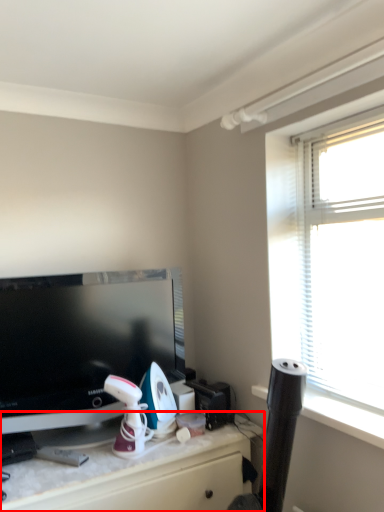
Question: Considering the relative positions of desk (annotated by the red box) and television in the image provided, where is desk (annotated by the red box) located with respect to the staircase?

Choices:
 (A) left
 (B) right

Answer: (B)